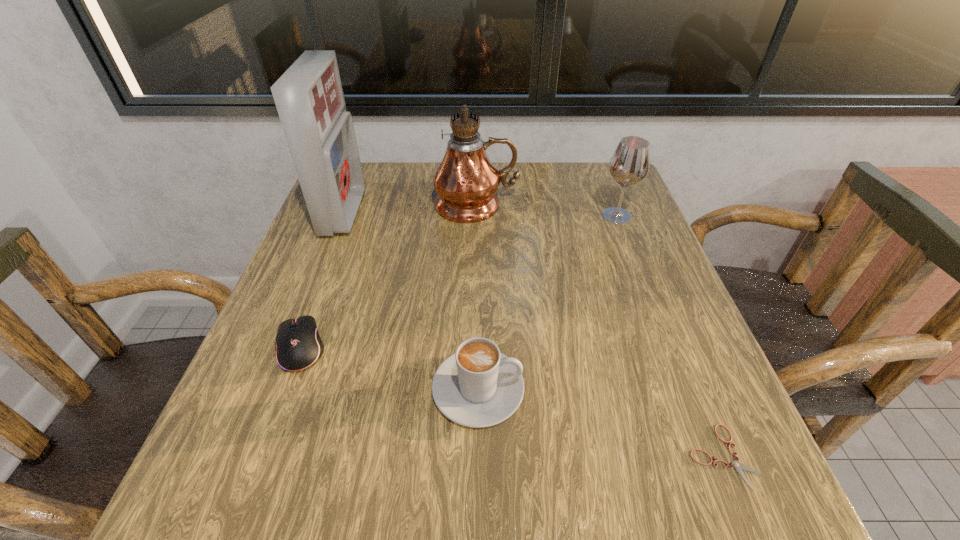
Locate an element on the screen. free spot that satisfies the following two spatial constraints: 1. to the right of the shortest object; 2. on the left side of the fourth tallest object is located at coordinates (478, 456).

The image size is (960, 540). I want to click on blank space that satisfies the following two spatial constraints: 1. on the front-facing side of the shears; 2. on the right side of the fifth shortest object, so click(249, 456).

Locate an element on the screen. The image size is (960, 540). vacant region that satisfies the following two spatial constraints: 1. on the front-facing side of the second tallest object; 2. on the back side of the shortest object is located at coordinates (249, 456).